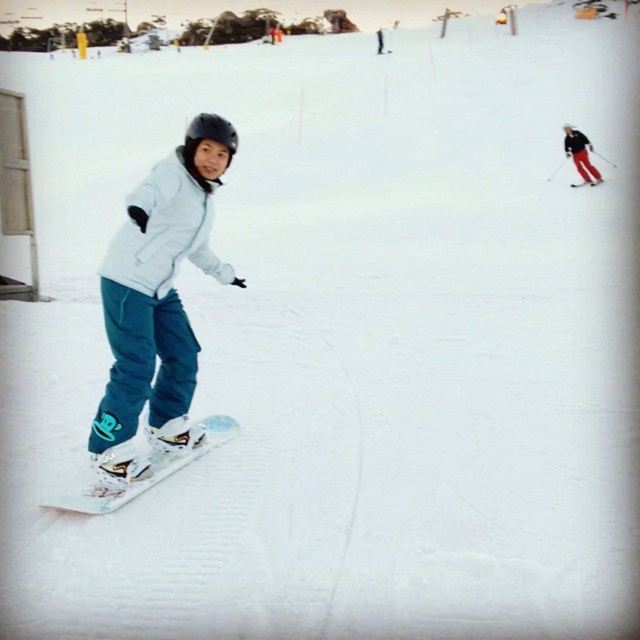
Who is shorter, teal matte snow pants at left or white glossy snowboard at lower left?

white glossy snowboard at lower left

Is teal matte snow pants at left to the right of white glossy snowboard at lower left from the viewer's perspective?

No, teal matte snow pants at left is not to the right of white glossy snowboard at lower left.

Which is in front, point (141, 257) or point (150, 481)?

Point (141, 257) is in front.

Where is `teal matte snow pants at left`? The height and width of the screenshot is (640, 640). teal matte snow pants at left is located at coordinates (157, 300).

Is point (86, 500) closer to viewer compared to point (564, 144)?

Yes, it is.

Image resolution: width=640 pixels, height=640 pixels. I want to click on white glossy snowboard at lower left, so click(x=145, y=472).

This screenshot has width=640, height=640. What are the coordinates of `teal matte snow pants at left` in the screenshot? It's located at (157, 300).

Which is above, teal matte snow pants at left or matte red ski pants at right?

matte red ski pants at right is above.

Locate an element on the screen. teal matte snow pants at left is located at coordinates (157, 300).